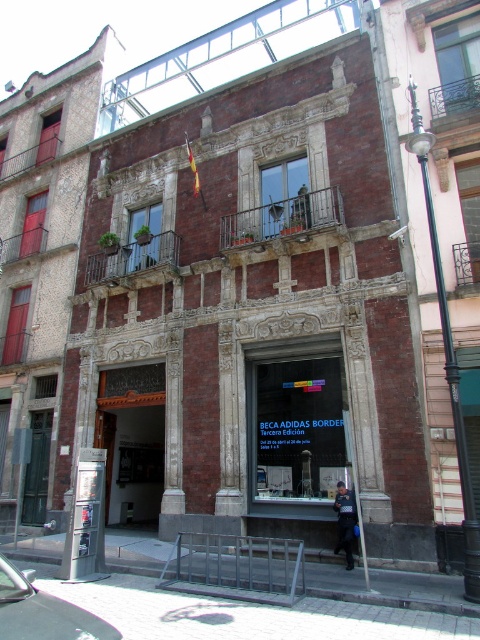
How far apart are brick facade storefront at center and dark blue uniform at center?

brick facade storefront at center is 5.49 meters from dark blue uniform at center.

Is brick facade storefront at center further to camera compared to dark blue uniform at center?

No, brick facade storefront at center is in front of dark blue uniform at center.

Between point (364, 508) and point (350, 515), which one is positioned in front?

Point (350, 515)

This screenshot has width=480, height=640. Find the location of `brick facade storefront at center`. brick facade storefront at center is located at coordinates (252, 314).